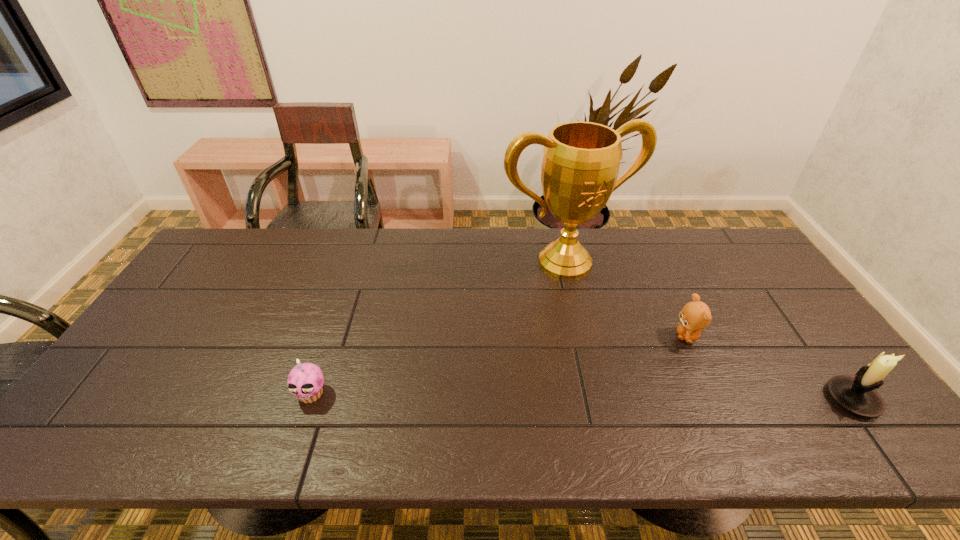
Find the location of `free space located 0.370m on the front-facing side of the third object from right to left`. free space located 0.370m on the front-facing side of the third object from right to left is located at coordinates (654, 376).

Find the location of a particular element. This screenshot has width=960, height=540. vacant space positioned 0.220m on the face of the second farthest object is located at coordinates (657, 404).

Locate an element on the screen. vacant space located on the face of the second farthest object is located at coordinates (652, 414).

The width and height of the screenshot is (960, 540). Identify the location of vacant space situated 0.120m on the face of the second farthest object. (670, 376).

Image resolution: width=960 pixels, height=540 pixels. I want to click on object located in the far edge section of the desktop, so click(581, 161).

Identify the location of cupcake at the near edge. This screenshot has height=540, width=960. (305, 381).

Identify the location of candle holder that is at the near edge. (858, 395).

You are a GUI agent. You are given a task and a screenshot of the screen. Output one action in this format:
    pyautogui.click(x=<x>, y=<y>)
    Task: Click on the object located at the right edge
    The height and width of the screenshot is (540, 960).
    Given the screenshot: What is the action you would take?
    pyautogui.click(x=858, y=395)

This screenshot has width=960, height=540. What are the coordinates of `object present at the near right corner` in the screenshot? It's located at (858, 395).

Locate an element on the screen. Image resolution: width=960 pixels, height=540 pixels. vacant space at the far edge is located at coordinates (411, 264).